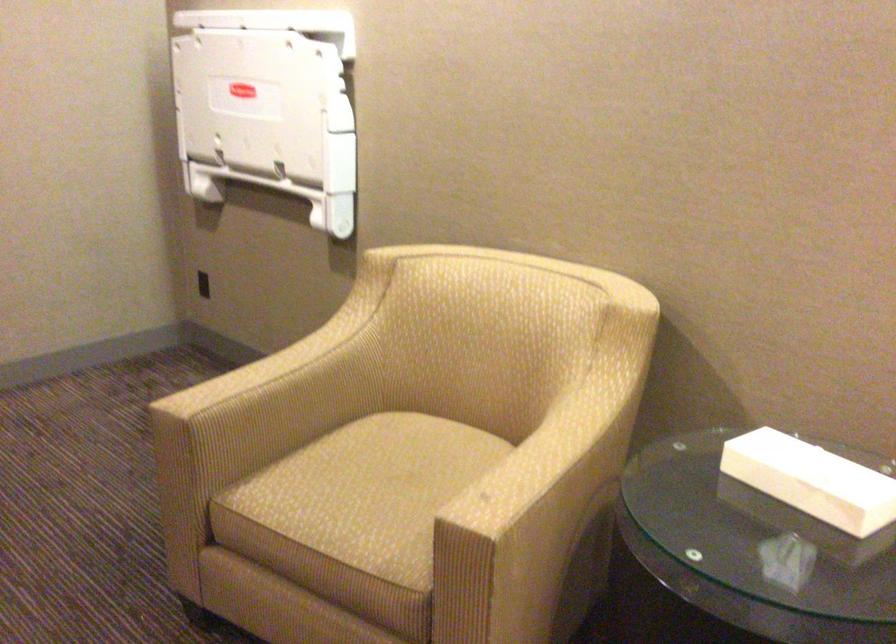
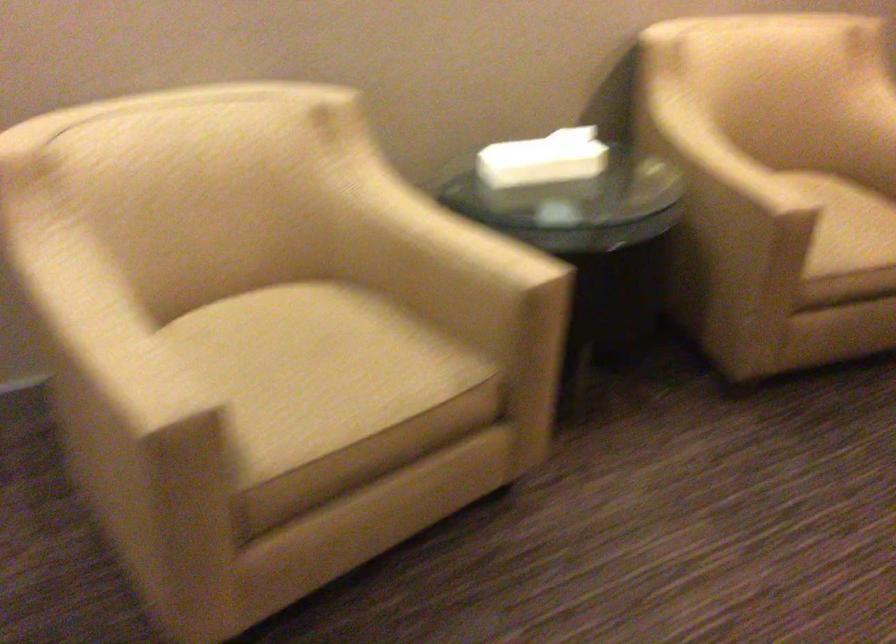
Locate, in the second image, the point that corresponds to (x=298, y=352) in the first image.

(89, 304)